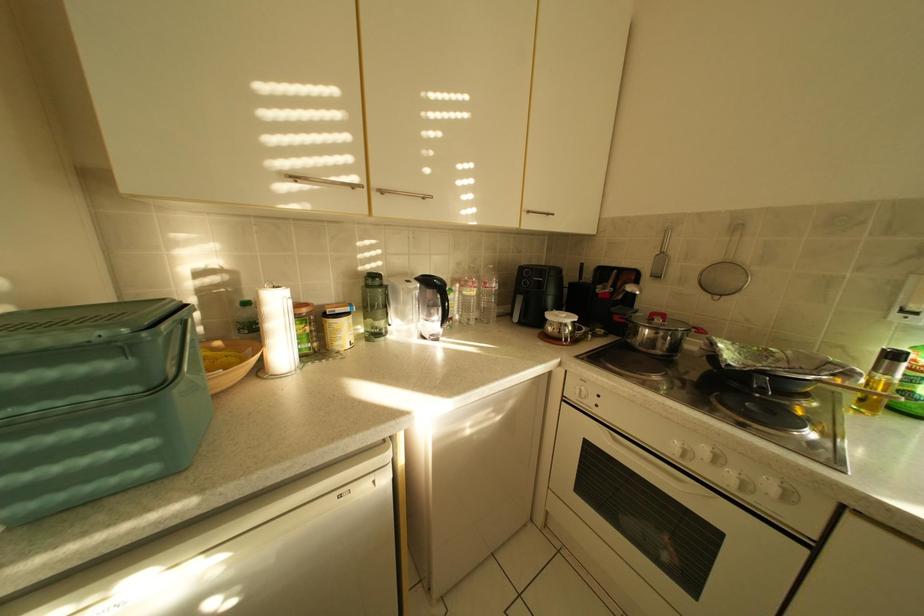
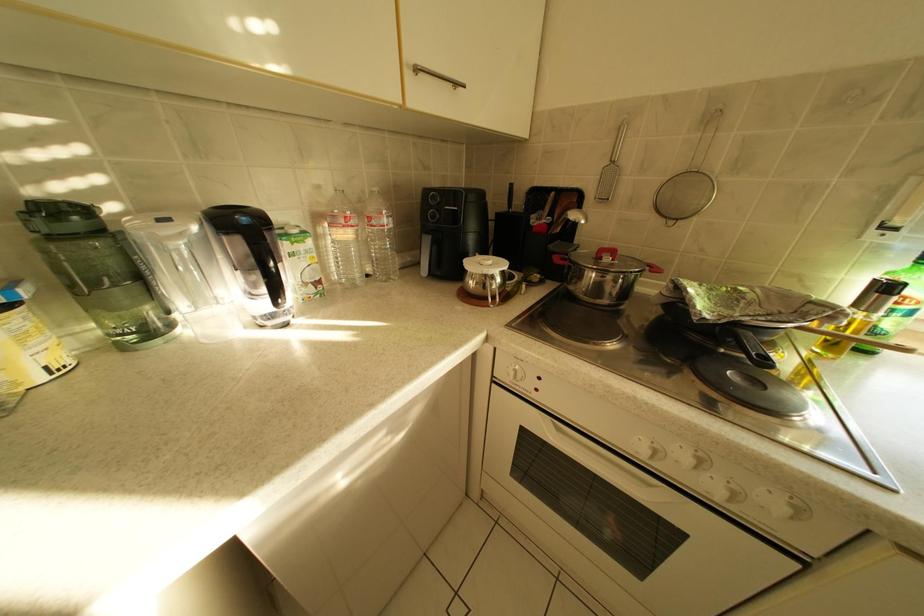
Question: The images are taken continuously from a first-person perspective. In which direction is your viewpoint rotating?

Choices:
 (A) Left
 (B) Right
 (C) Up
 (D) Down

Answer: (B)